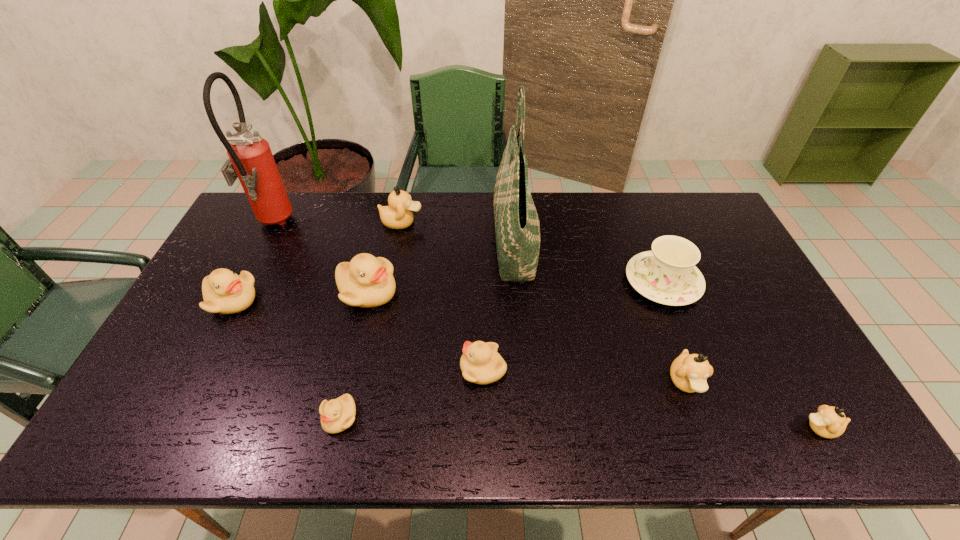
Where is `vacant region located 0.170m on the handle side of the chinaware`? Image resolution: width=960 pixels, height=540 pixels. vacant region located 0.170m on the handle side of the chinaware is located at coordinates (569, 282).

You are a GUI agent. You are given a task and a screenshot of the screen. Output one action in this format:
    pyautogui.click(x=<x>, y=<y>)
    Task: Click on the free space located 0.070m on the handle side of the chinaware
    The image size is (960, 540).
    Given the screenshot: What is the action you would take?
    pyautogui.click(x=602, y=282)

This screenshot has width=960, height=540. In order to click on free space located 0.240m on the handle side of the chinaware in this screenshot , I will do `click(547, 282)`.

Identify the location of vacant space located 0.400m on the beak of the third smallest yellow duckling. (393, 301).

Where is `free location located on the face of the second farthest tan duckling`? free location located on the face of the second farthest tan duckling is located at coordinates (709, 449).

Find the location of `vacant area located 0.150m on the beak of the third farthest yellow duckling`. vacant area located 0.150m on the beak of the third farthest yellow duckling is located at coordinates (402, 369).

The image size is (960, 540). I want to click on vacant space situated 0.180m on the beak of the third farthest yellow duckling, so click(x=390, y=369).

Identify the location of free space located on the beak of the third farthest yellow duckling. The image size is (960, 540). (418, 369).

The image size is (960, 540). In order to click on free point located on the face of the rightmost tan duckling in this screenshot , I will do [x=646, y=428].

You are a GUI agent. You are given a task and a screenshot of the screen. Output one action in this format:
    pyautogui.click(x=<x>, y=<y>)
    Task: Click on the vacant area situated on the face of the rightmost tan duckling
    This screenshot has width=960, height=540.
    Given the screenshot: What is the action you would take?
    pyautogui.click(x=771, y=428)